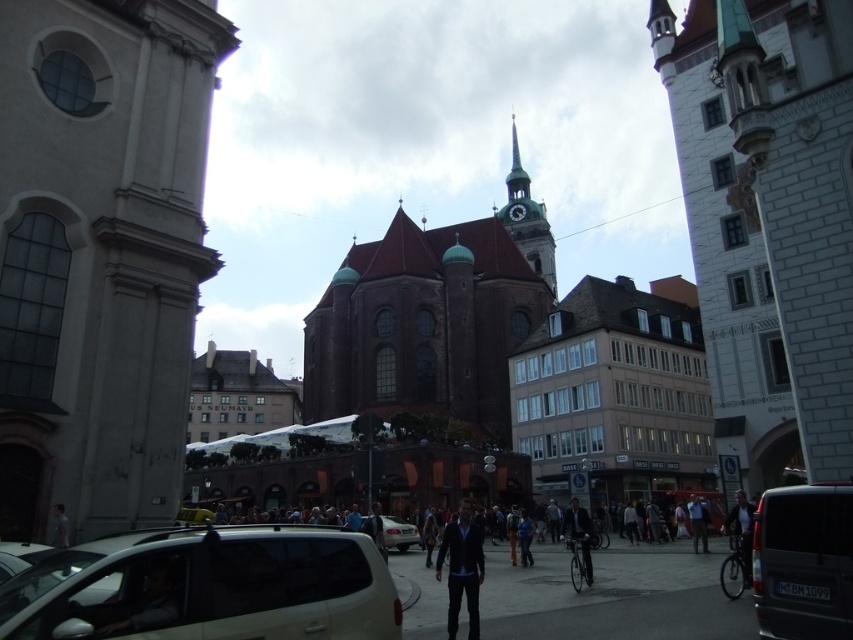
Consider the image. You are standing in the middle of the street looking at the scene. Which object is closer to you, the brown stone church at center or the dark blue jacket at center?

The dark blue jacket at center is closer to you because the brown stone church at center is positioned over it, indicating it is behind.

You are standing on the street in front of the brown stone church at center and want to take a photo of the white stone tower at left. Since the church is in the way, can you still see the tower from your current position?

The white stone tower at left is positioned under the brown stone church at center, so you cannot see the tower from your current position because it is blocked by the church.